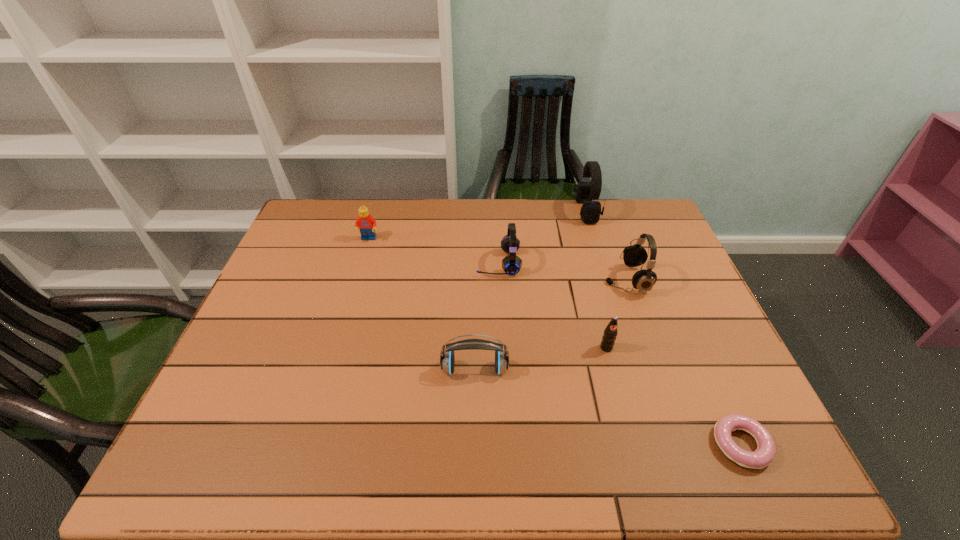
Identify the location of the farthest object. (590, 212).

This screenshot has height=540, width=960. Find the location of `the tallest object`. the tallest object is located at coordinates (590, 212).

Image resolution: width=960 pixels, height=540 pixels. I want to click on the second farthest object, so click(367, 224).

Where is `the leftmost object`? The image size is (960, 540). the leftmost object is located at coordinates (367, 224).

Locate an element on the screen. the nearest headset is located at coordinates (447, 361).

Where is `the shortest headset`? the shortest headset is located at coordinates (447, 361).

Where is `pop`? Image resolution: width=960 pixels, height=540 pixels. pop is located at coordinates (610, 333).

Locate an element on the screen. the shortest object is located at coordinates point(764,455).

Locate an element on the screen. Image resolution: width=960 pixels, height=540 pixels. the nearest object is located at coordinates (764, 455).

Locate an element on the screen. This screenshot has width=960, height=540. free space located 0.110m on the headband of the farthest headset is located at coordinates (543, 212).